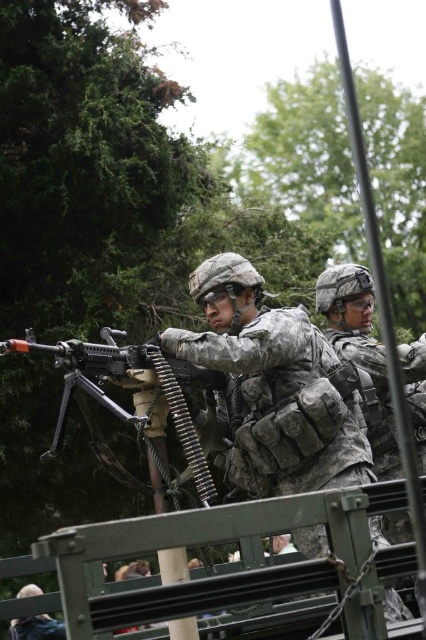
Is green metal rail at lower center to the right of camouflage uniform at lower left from the viewer's perspective?

Indeed, green metal rail at lower center is positioned on the right side of camouflage uniform at lower left.

Who is more distant from viewer, (356, 513) or (63, 634)?

Positioned behind is point (63, 634).

Which is behind, point (201, 513) or point (20, 636)?

Point (20, 636)

Image resolution: width=426 pixels, height=640 pixels. I want to click on green metal rail at lower center, so click(x=207, y=536).

Is point (229, 259) closer to viewer compared to point (417, 381)?

Yes.

Does camouflage fabric uniform at center appear on the right side of camouflage fabric helmet at center?

Incorrect, camouflage fabric uniform at center is not on the right side of camouflage fabric helmet at center.

Who is more forward, (x=169, y=337) or (x=414, y=358)?

Point (x=169, y=337) is in front.

This screenshot has height=640, width=426. Identify the location of camouflage fabric uniform at center. (273, 387).

Is point (92, 524) in front of point (201, 460)?

Yes, point (92, 524) is in front of point (201, 460).

Is green metal rail at lower center positioned at the back of matte black rifle at center?

No, it is not.

You are a GUI agent. You are given a task and a screenshot of the screen. Output one action in this format:
    pyautogui.click(x=<x>, y=<y>)
    Task: Click on the green metal rail at lower center
    This screenshot has width=426, height=640.
    Given the screenshot: What is the action you would take?
    pyautogui.click(x=207, y=536)